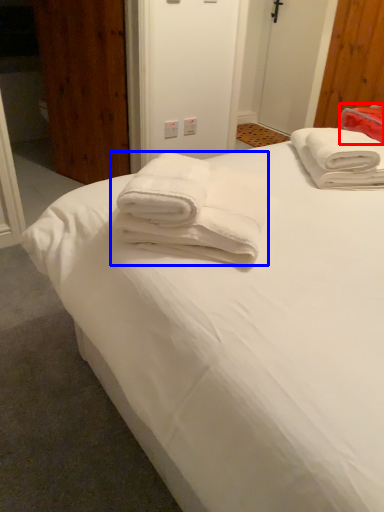
Question: Which of the following is the farthest to the observer, cloth (highlighted by a red box) or towel (highlighted by a blue box)?

Choices:
 (A) cloth
 (B) towel

Answer: (A)